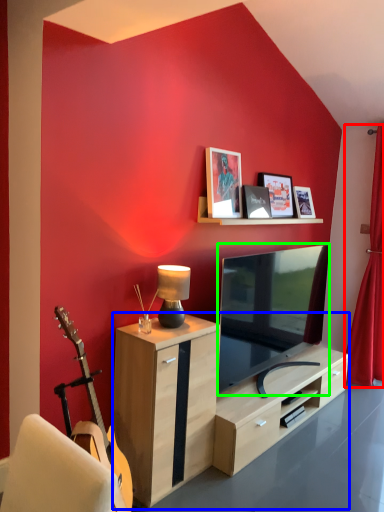
Question: Estimate the real-world distances between objects in this image. Which object is farther from curtain (highlighted by a red box), desk (highlighted by a blue box) or television (highlighted by a green box)?

Choices:
 (A) desk
 (B) television

Answer: (A)